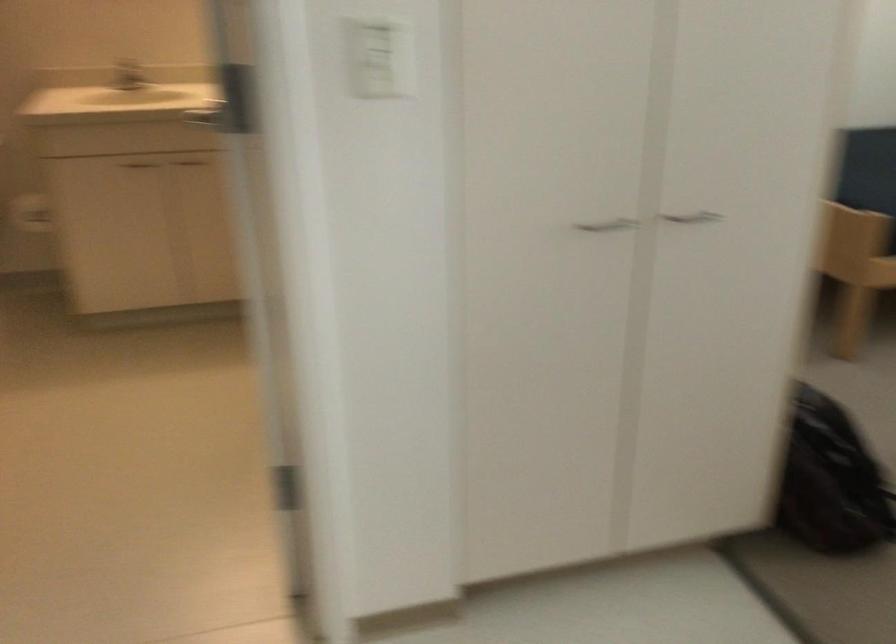
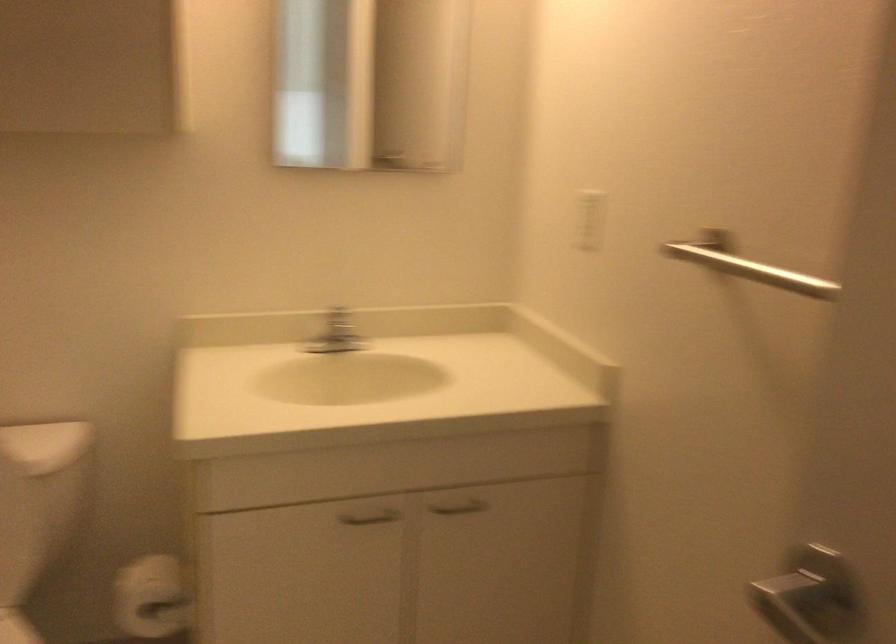
In a continuous first-person perspective shot, in which direction is the camera moving?

The cameraman walked toward left, forward.